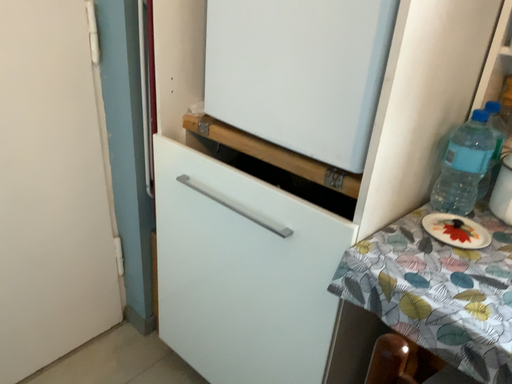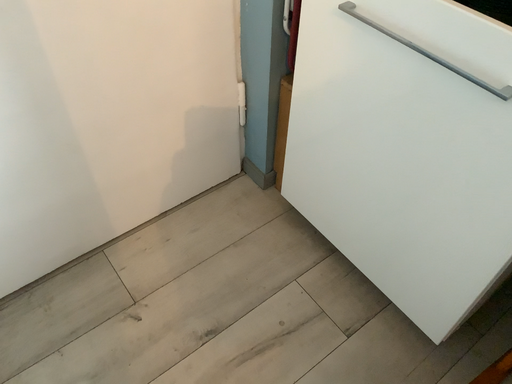
Question: How did the camera likely rotate when shooting the video?

Choices:
 (A) rotated upward
 (B) rotated downward

Answer: (B)